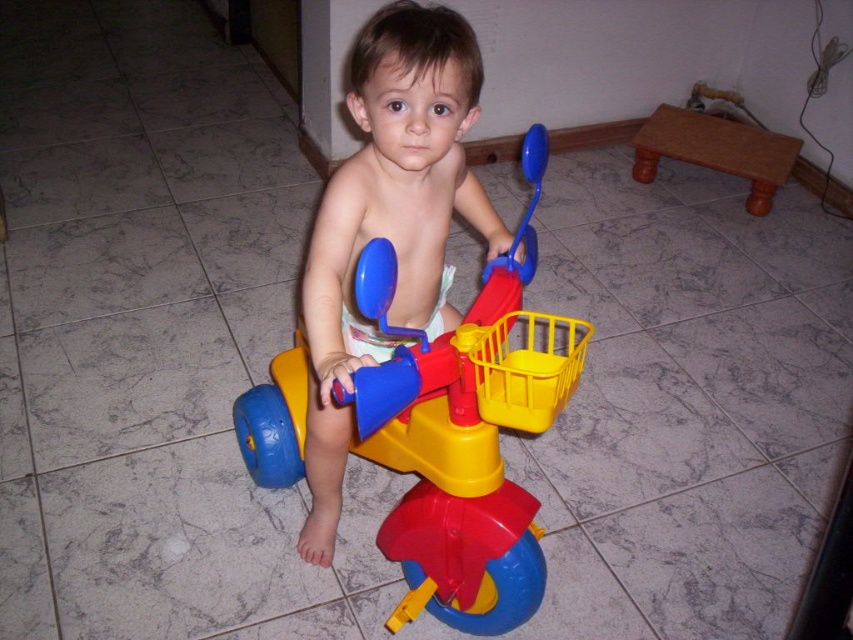
Question: Which of the following is the farthest from the observer?

Choices:
 (A) (573, 349)
 (B) (401, 212)

Answer: (B)

Question: Which of the following is the closest to the observer?

Choices:
 (A) matte plastic child at center
 (B) matte plastic tricycle at center

Answer: (B)

Question: Does matte plastic tricycle at center come in front of matte plastic child at center?

Choices:
 (A) yes
 (B) no

Answer: (A)

Question: Can you confirm if matte plastic tricycle at center is positioned to the right of matte plastic child at center?

Choices:
 (A) yes
 (B) no

Answer: (A)

Question: Which object is farther from the camera taking this photo?

Choices:
 (A) matte plastic tricycle at center
 (B) matte plastic child at center

Answer: (B)

Question: Can you confirm if matte plastic tricycle at center is smaller than matte plastic child at center?

Choices:
 (A) yes
 (B) no

Answer: (B)